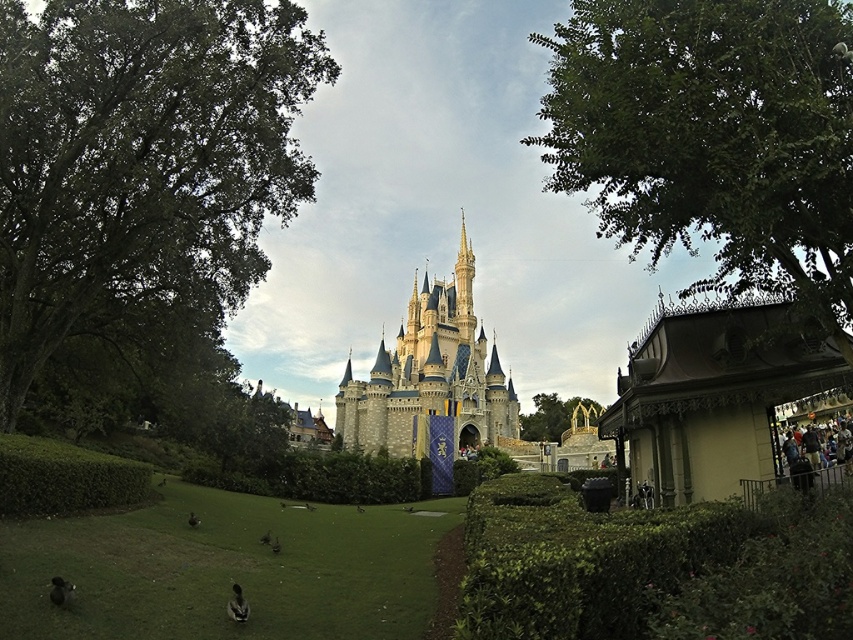
Looking at this image, you are standing in front of the castle and want to walk towards the green leafy hedge at lower right and the green leafy hedge at lower left. Which hedge will you reach first?

The green leafy hedge at lower right is closer to the viewer than the green leafy hedge at lower left, so you will reach the green leafy hedge at lower right first.